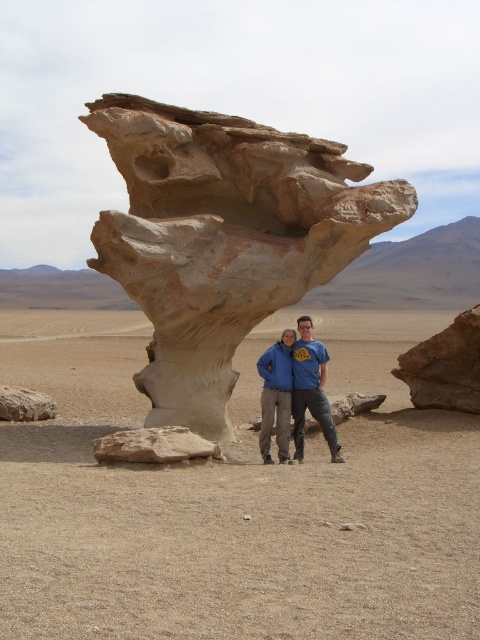
Locate an element on the screen. blue fleece jacket at center is located at coordinates (276, 396).

Can you confirm if blue fleece jacket at center is taller than smooth beige rock at lower left?

Correct, blue fleece jacket at center is much taller as smooth beige rock at lower left.

Measure the distance between point (283, 460) and camera.

They are 41.35 meters apart.

You are a GUI agent. You are given a task and a screenshot of the screen. Output one action in this format:
    pyautogui.click(x=<x>, y=<y>)
    Task: Click on the blue fleece jacket at center
    The width and height of the screenshot is (480, 640).
    Given the screenshot: What is the action you would take?
    pyautogui.click(x=276, y=396)

Does point (300, 429) lie behind point (173, 426)?

Yes, point (300, 429) is farther from viewer.

This screenshot has height=640, width=480. I want to click on blue fabric couple at center, so click(298, 387).

Is white sandstone rock formation at center further to the viewer compared to blue fabric couple at center?

Yes, white sandstone rock formation at center is further from the viewer.

Between white sandstone rock formation at center and blue fabric couple at center, which one is positioned higher?

white sandstone rock formation at center is above.

Locate an element on the screen. This screenshot has width=480, height=640. white sandstone rock formation at center is located at coordinates (223, 237).